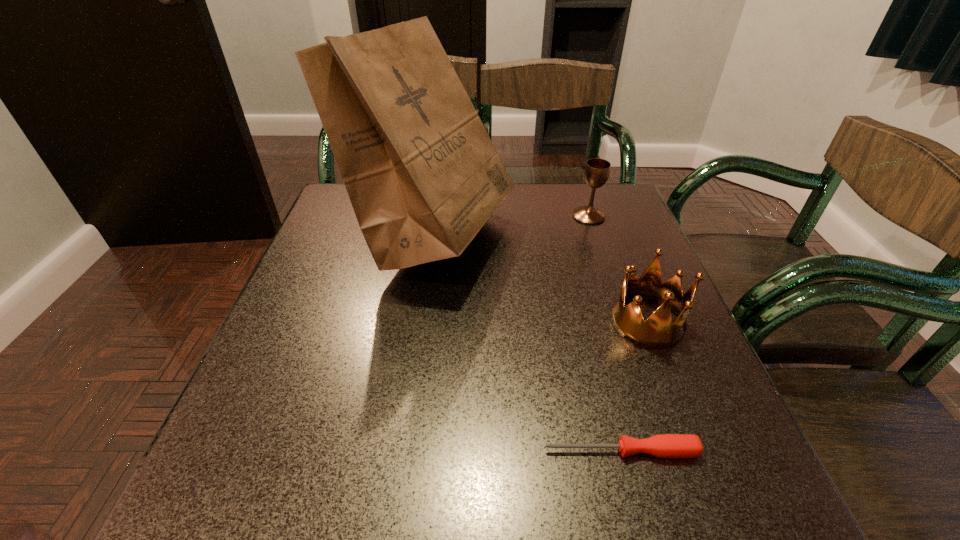
Image resolution: width=960 pixels, height=540 pixels. Identify the location of vacant space that satisfies the following two spatial constraints: 1. on the back side of the grocery bag; 2. on the left side of the chalice. coord(437,216).